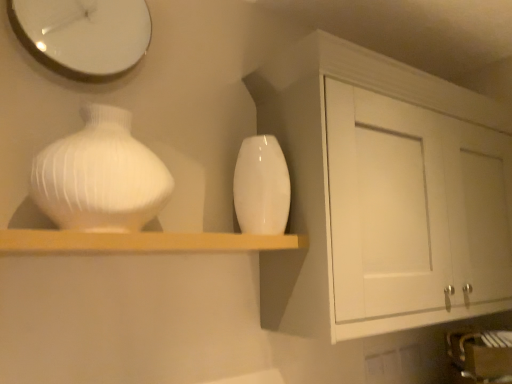
Question: From the image's perspective, is glossy ceramic vase at center, positioned as the first vase in back-to-front order, positioned above or below white glossy vase at left, acting as the first vase starting from the left?

Choices:
 (A) below
 (B) above

Answer: (A)

Question: Considering the positions of glossy ceramic vase at center, which ranks as the 1th vase in right-to-left order, and white glossy vase at left, arranged as the 2th vase when viewed from the back, in the image, is glossy ceramic vase at center, which ranks as the 1th vase in right-to-left order, wider or thinner than white glossy vase at left, arranged as the 2th vase when viewed from the back,?

Choices:
 (A) wide
 (B) thin

Answer: (B)

Question: Considering the real-world distances, which object is farthest from the white glossy clock at upper left?

Choices:
 (A) glossy ceramic vase at center, positioned as the first vase in back-to-front order
 (B) white glossy vase at left, arranged as the 2th vase when viewed from the back
 (C) white matte cabinet at upper right
 (D) wooden shelf at center

Answer: (C)

Question: Estimate the real-world distances between objects in this image. Which object is closer to the glossy ceramic vase at center, which ranks as the 1th vase in right-to-left order?

Choices:
 (A) wooden shelf at center
 (B) white glossy vase at left, arranged as the 2th vase when viewed from the back
 (C) white glossy clock at upper left
 (D) white matte cabinet at upper right

Answer: (A)